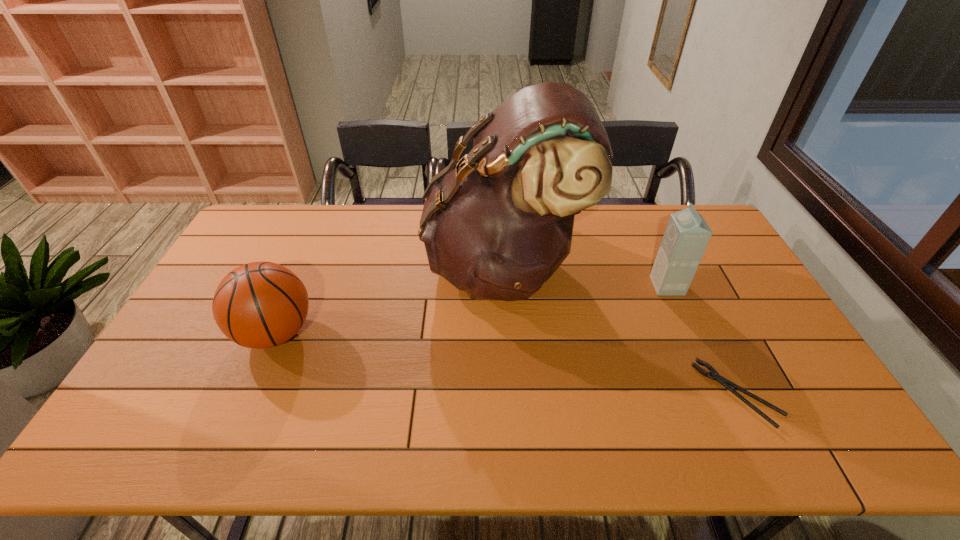
This screenshot has width=960, height=540. I want to click on free space at the left edge of the desktop, so click(165, 403).

Where is `vacant space at the right edge of the desktop`? The image size is (960, 540). vacant space at the right edge of the desktop is located at coordinates (723, 284).

Identify the location of free region at the near right corner of the desktop. This screenshot has height=540, width=960. (801, 446).

I want to click on free point between the third object from right to left and the tongs, so click(620, 330).

This screenshot has width=960, height=540. Find the location of `empty location between the third shortest object and the basketball`. empty location between the third shortest object and the basketball is located at coordinates (471, 310).

You are a GUI agent. You are given a task and a screenshot of the screen. Output one action in this format:
    pyautogui.click(x=<x>, y=<y>)
    Task: Click on the empty space between the third object from right to left and the leftmost object
    
    Given the screenshot: What is the action you would take?
    pyautogui.click(x=390, y=300)

Find the location of a particular element. vacant area that lies between the second tallest object and the basketball is located at coordinates (471, 310).

In order to click on free spot between the basketball and the second tallest object in this screenshot , I will do `click(471, 310)`.

The image size is (960, 540). Identify the location of vacant area that lies between the leftmost object and the carton. (x=471, y=310).

Identify the location of free point between the leftmost object and the second tallest object. (471, 310).